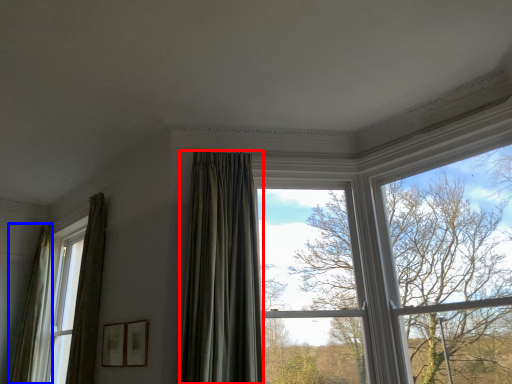
Question: Which of the following is the farthest to the observer, curtain (highlighted by a red box) or curtain (highlighted by a blue box)?

Choices:
 (A) curtain
 (B) curtain

Answer: (B)